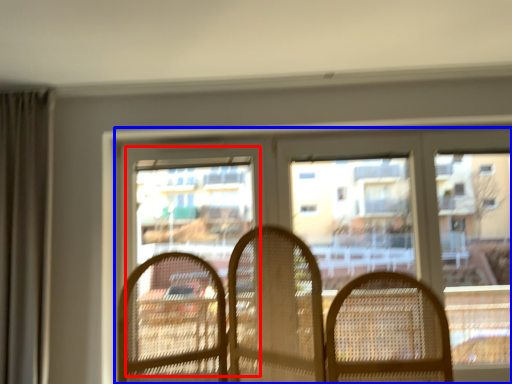
Question: Which of the following is the farthest to the observer, screen door (highlighted by a red box) or window (highlighted by a blue box)?

Choices:
 (A) screen door
 (B) window

Answer: (A)